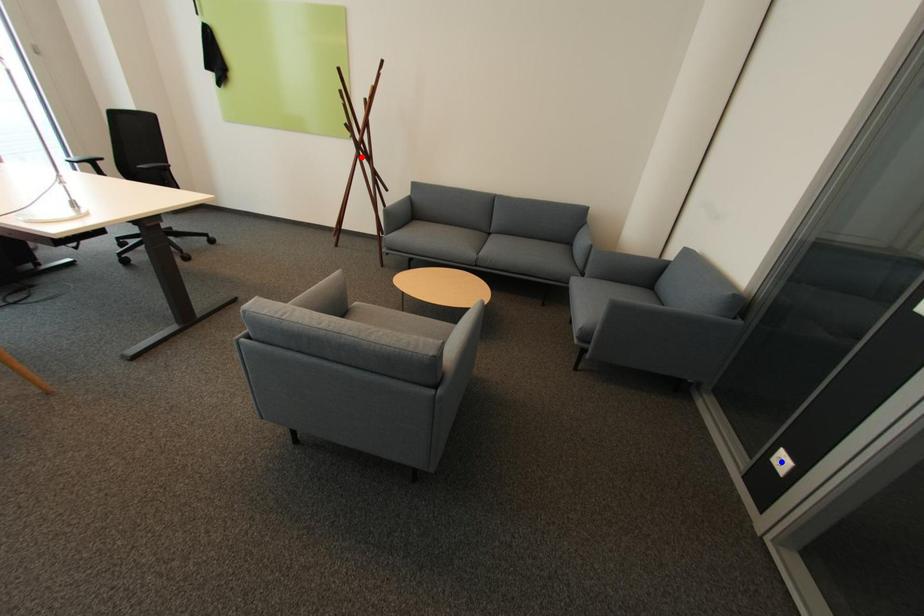
Question: Which of the two points in the image is closer to the camera?

Choices:
 (A) Blue point is closer.
 (B) Red point is closer.

Answer: (A)